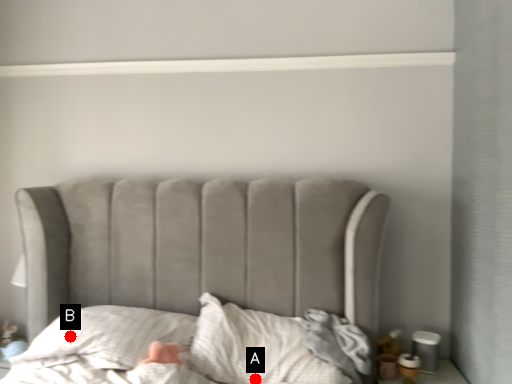
Question: Two points are circled on the image, labeled by A and B beside each circle. Which of the following is the closest to the observer?

Choices:
 (A) A is closer
 (B) B is closer

Answer: (A)